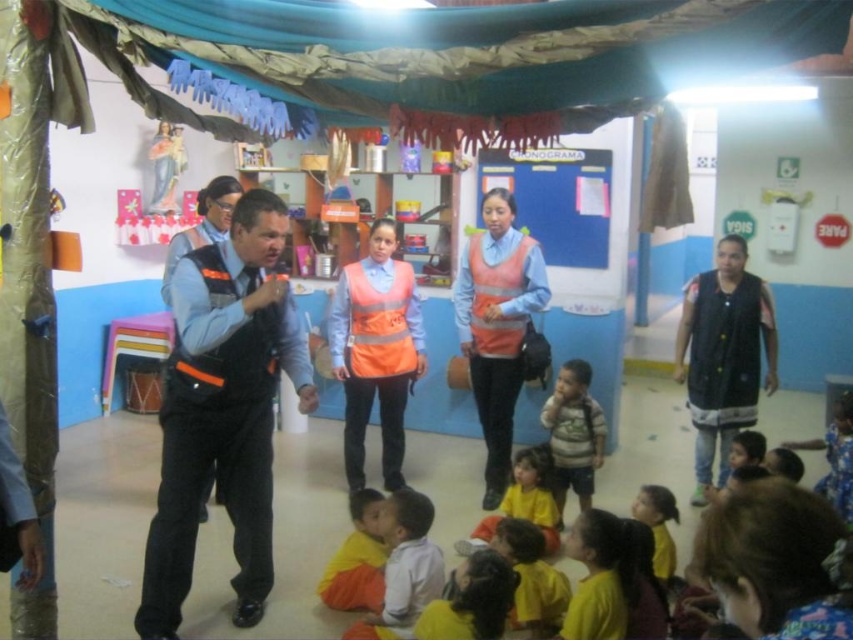
Find the location of a particular element. white cotton shirt at lower center is located at coordinates tap(404, 566).

Which is more to the right, white cotton shirt at lower center or orange reflective safety vest at center?

Positioned to the right is orange reflective safety vest at center.

Describe the element at coordinates (404, 566) in the screenshot. Image resolution: width=853 pixels, height=640 pixels. I see `white cotton shirt at lower center` at that location.

I want to click on white cotton shirt at lower center, so click(404, 566).

Can you confirm if reflective orange vest at center is smaller than neon orange reflective safety vest at center?

No, reflective orange vest at center is not smaller than neon orange reflective safety vest at center.

Measure the distance between point (x=180, y=509) and camera.

Point (x=180, y=509) is 2.66 meters from camera.

You are a GUI agent. You are given a task and a screenshot of the screen. Output one action in this format:
    pyautogui.click(x=<x>, y=<y>)
    Task: Click on the reflective orange vest at center
    Image resolution: width=853 pixels, height=640 pixels.
    Given the screenshot: What is the action you would take?
    pyautogui.click(x=223, y=410)

The image size is (853, 640). What do you see at coordinates (573, 433) in the screenshot? I see `striped cotton shirt at center` at bounding box center [573, 433].

Is striped cotton shirt at center above orange reflective safety vest at center?

No.

What are the coordinates of `striped cotton shirt at center` in the screenshot? It's located at (573, 433).